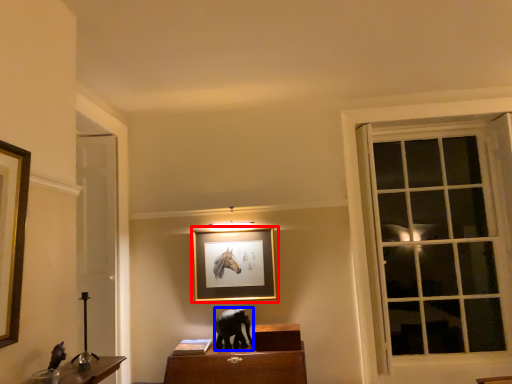
Question: Among these objects, which one is farthest to the camera, picture frame (highlighted by a red box) or animal (highlighted by a blue box)?

Choices:
 (A) picture frame
 (B) animal

Answer: (A)